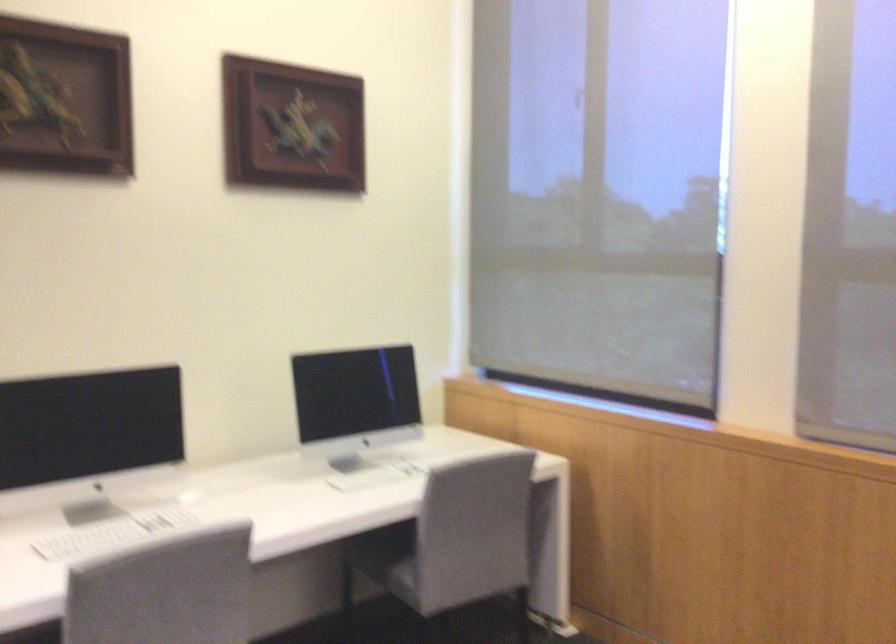
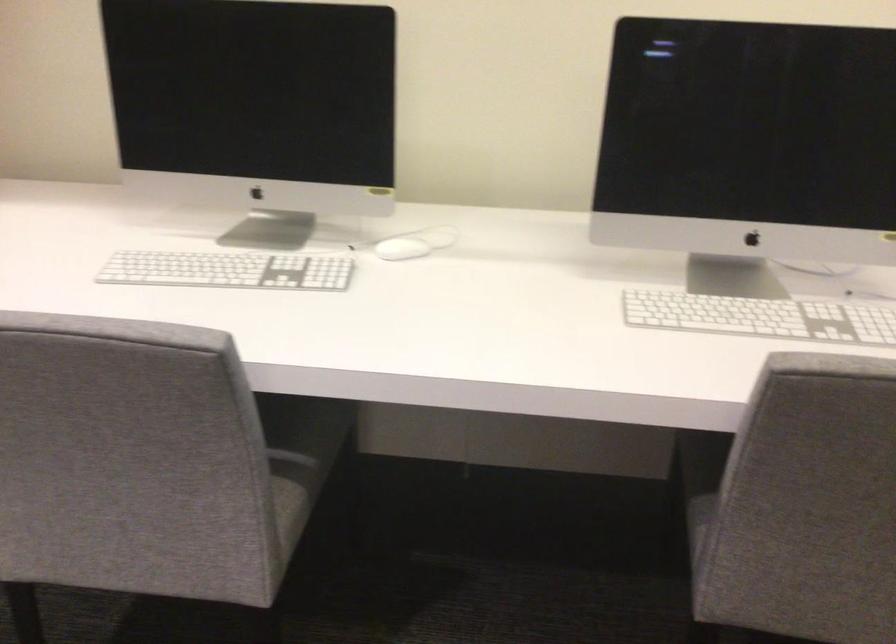
Locate, in the second image, the point that corresponds to pixel 119 529 in the first image.

(228, 270)